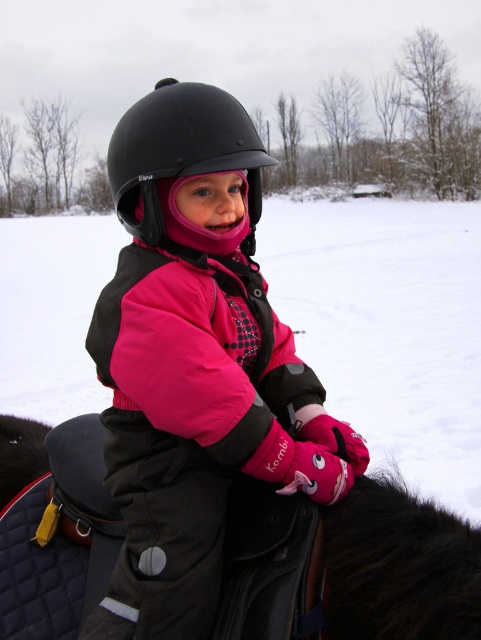
What is the exact location of the pink matte jacket at center in the image?

The pink matte jacket at center is located at point coordinates of (195,362).

You are a photographer trying to capture the child in the winter scene. Since the pink matte jacket at center and white powdery snow at center are both in the center, which one is closer to the camera?

The pink matte jacket at center is below white powdery snow at center, so the white powdery snow at center is closer to the camera.